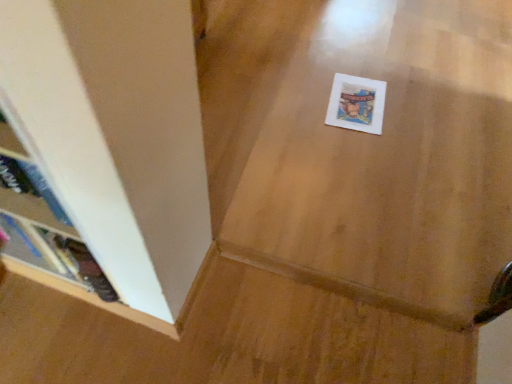
Where is `free region under white paper postcard at center (from a real-world perspective)`? The image size is (512, 384). free region under white paper postcard at center (from a real-world perspective) is located at coordinates (359, 103).